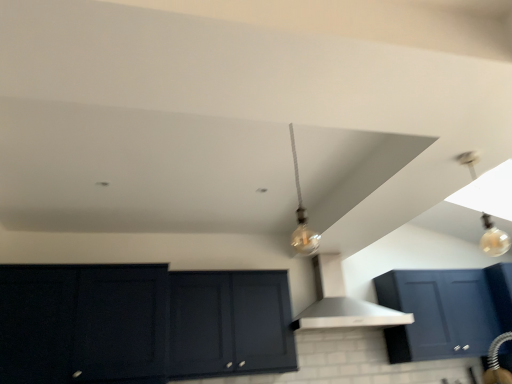
Question: Does matte dark blue cabinet at lower left, which is counted as the first cabinetry, starting from the left, have a smaller size compared to matte black cabinet at center, the 1th cabinetry when ordered from right to left?

Choices:
 (A) yes
 (B) no

Answer: (B)

Question: Does matte dark blue cabinet at lower left, which is counted as the first cabinetry, starting from the left, have a larger size compared to matte black cabinet at center, the 1th cabinetry when ordered from right to left?

Choices:
 (A) yes
 (B) no

Answer: (A)

Question: From a real-world perspective, is matte dark blue cabinet at lower left, placed as the 2th cabinetry when sorted from right to left, located beneath matte black cabinet at center, which is the 2th cabinetry in left-to-right order?

Choices:
 (A) no
 (B) yes

Answer: (B)

Question: From a real-world perspective, is matte dark blue cabinet at lower left, placed as the 2th cabinetry when sorted from right to left, located higher than matte black cabinet at center, which is the 2th cabinetry in left-to-right order?

Choices:
 (A) no
 (B) yes

Answer: (A)

Question: Does matte dark blue cabinet at lower left, which is counted as the first cabinetry, starting from the left, appear on the left side of matte black cabinet at center, the 1th cabinetry when ordered from right to left?

Choices:
 (A) no
 (B) yes

Answer: (B)

Question: Is matte dark blue cabinet at lower left, which is counted as the first cabinetry, starting from the left, oriented away from matte black cabinet at center, which is the 2th cabinetry in left-to-right order?

Choices:
 (A) yes
 (B) no

Answer: (B)

Question: Is the position of white matte vent at center less distant than that of matte black cabinet at center, the 1th cabinetry when ordered from right to left?

Choices:
 (A) yes
 (B) no

Answer: (B)

Question: Is white matte vent at center to the left of matte black cabinet at center, the 1th cabinetry when ordered from right to left, from the viewer's perspective?

Choices:
 (A) yes
 (B) no

Answer: (B)

Question: From a real-world perspective, is white matte vent at center located higher than matte black cabinet at center, which is the 2th cabinetry in left-to-right order?

Choices:
 (A) yes
 (B) no

Answer: (A)

Question: Does white matte vent at center have a smaller size compared to matte black cabinet at center, which is the 2th cabinetry in left-to-right order?

Choices:
 (A) no
 (B) yes

Answer: (A)

Question: Is white matte vent at center far from matte black cabinet at center, the 1th cabinetry when ordered from right to left?

Choices:
 (A) no
 (B) yes

Answer: (A)

Question: Is white matte vent at center at the right side of matte black cabinet at center, the 1th cabinetry when ordered from right to left?

Choices:
 (A) yes
 (B) no

Answer: (A)

Question: Is matte dark blue cabinet at lower left, placed as the 2th cabinetry when sorted from right to left, taller than translucent glass bulb at upper right?

Choices:
 (A) yes
 (B) no

Answer: (A)